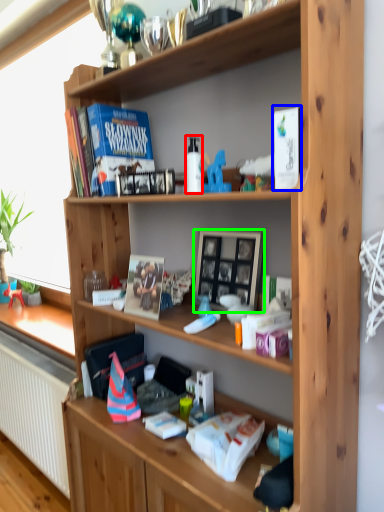
Question: Which object is positioned closest to bottle (highlighted by a red box)? Select from paperback book (highlighted by a blue box) and picture frame (highlighted by a green box).

Choices:
 (A) paperback book
 (B) picture frame

Answer: (B)